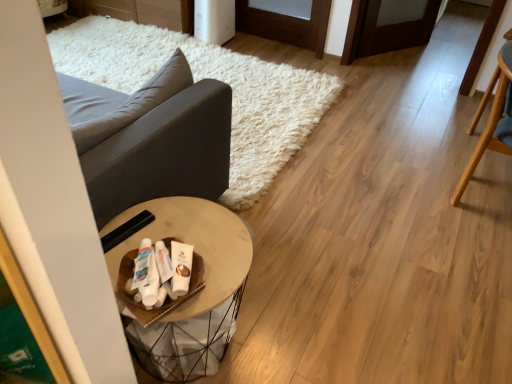
Question: From a real-world perspective, is matte black side table at center below wooden round table at center?

Choices:
 (A) yes
 (B) no

Answer: (A)

Question: From the image's perspective, is matte black side table at center beneath wooden round table at center?

Choices:
 (A) no
 (B) yes

Answer: (A)

Question: Is matte black side table at center bigger than wooden round table at center?

Choices:
 (A) yes
 (B) no

Answer: (A)

Question: Is matte black side table at center oriented away from wooden round table at center?

Choices:
 (A) yes
 (B) no

Answer: (B)

Question: Can you confirm if matte black side table at center is wider than wooden round table at center?

Choices:
 (A) no
 (B) yes

Answer: (B)

Question: Can you confirm if matte black side table at center is positioned to the right of wooden round table at center?

Choices:
 (A) no
 (B) yes

Answer: (A)

Question: Considering the relative sizes of wooden round table at center and dark gray fabric couch at left in the image provided, is wooden round table at center bigger than dark gray fabric couch at left?

Choices:
 (A) no
 (B) yes

Answer: (B)

Question: Does wooden round table at center turn towards dark gray fabric couch at left?

Choices:
 (A) no
 (B) yes

Answer: (A)

Question: Is wooden round table at center oriented away from dark gray fabric couch at left?

Choices:
 (A) no
 (B) yes

Answer: (A)

Question: From the image's perspective, is wooden round table at center under dark gray fabric couch at left?

Choices:
 (A) yes
 (B) no

Answer: (A)

Question: Is wooden round table at center thinner than dark gray fabric couch at left?

Choices:
 (A) no
 (B) yes

Answer: (A)

Question: Does wooden round table at center have a lesser height compared to dark gray fabric couch at left?

Choices:
 (A) yes
 (B) no

Answer: (B)

Question: From a real-world perspective, is dark gray fabric couch at left located higher than wooden round table at center?

Choices:
 (A) no
 (B) yes

Answer: (B)